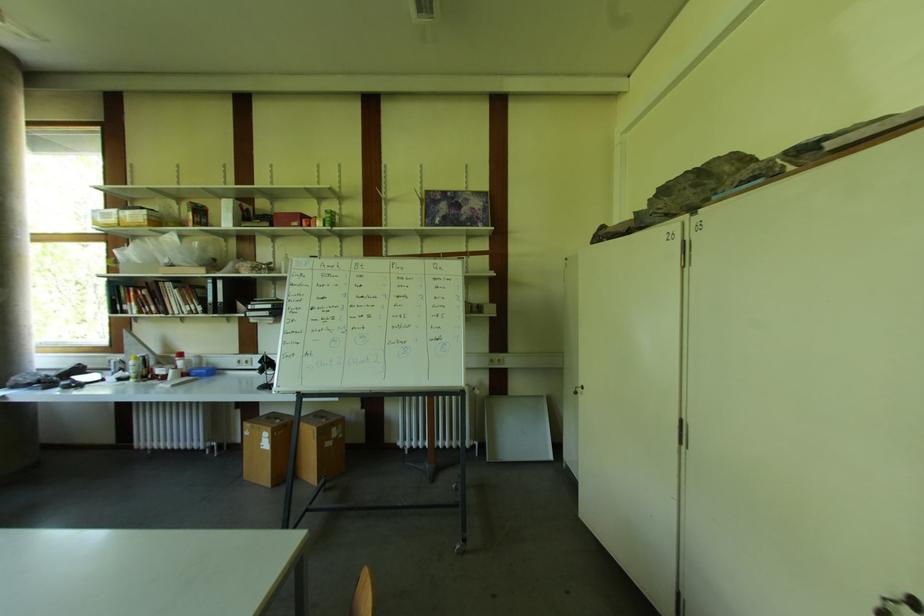
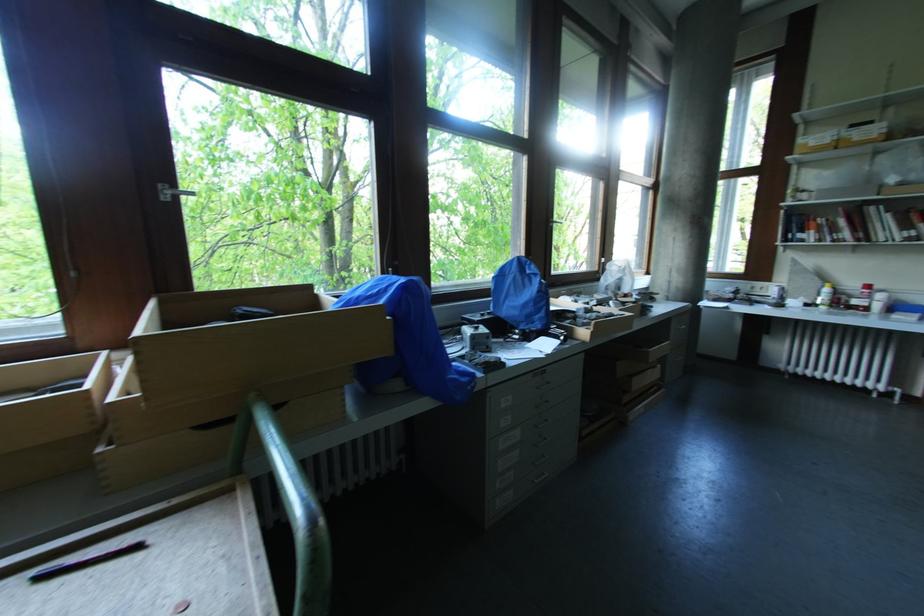
The point at (184, 357) is marked in the first image. Where is the corresponding point in the second image?

(871, 288)